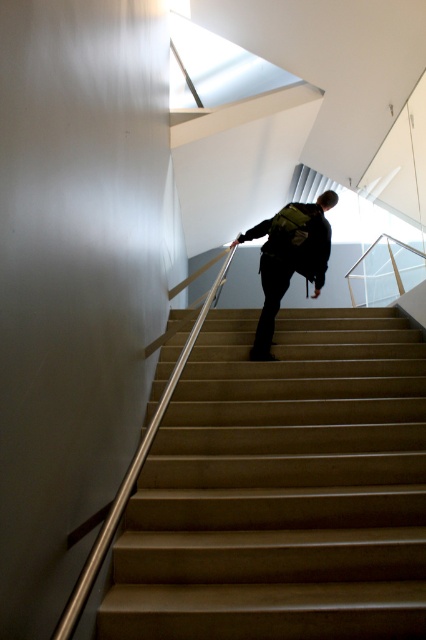
Question: Is the position of smooth beige stairs at center more distant than that of black matte backpack at center?

Choices:
 (A) yes
 (B) no

Answer: (B)

Question: Where is smooth beige stairs at center located in relation to black matte backpack at center in the image?

Choices:
 (A) above
 (B) below

Answer: (B)

Question: Does smooth beige stairs at center come behind black matte backpack at center?

Choices:
 (A) yes
 (B) no

Answer: (B)